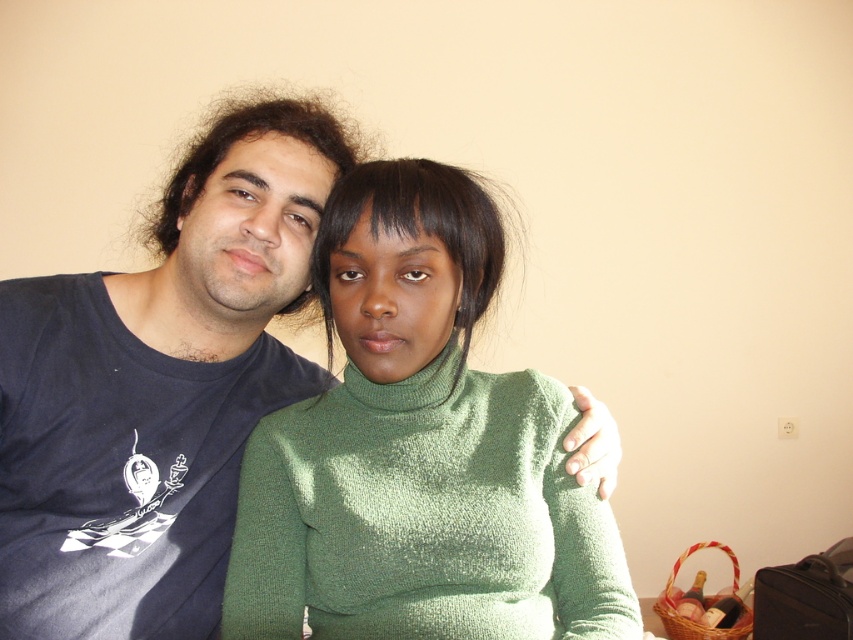
Question: Which of the following is the closest to the observer?

Choices:
 (A) dark blue t-shirt at left
 (B) green knitted sweater at center

Answer: (B)

Question: Is green knitted sweater at center positioned before dark blue t-shirt at left?

Choices:
 (A) no
 (B) yes

Answer: (B)

Question: Which object appears farthest from the camera in this image?

Choices:
 (A) dark blue t-shirt at left
 (B) green knitted sweater at center

Answer: (A)

Question: From the image, what is the correct spatial relationship of green knitted sweater at center in relation to dark blue t-shirt at left?

Choices:
 (A) right
 (B) left

Answer: (A)

Question: Does green knitted sweater at center appear on the right side of dark blue t-shirt at left?

Choices:
 (A) no
 (B) yes

Answer: (B)